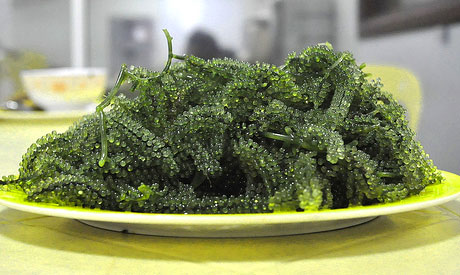
This screenshot has width=460, height=275. In order to click on yellow seat back in this screenshot , I will do `click(391, 78)`.